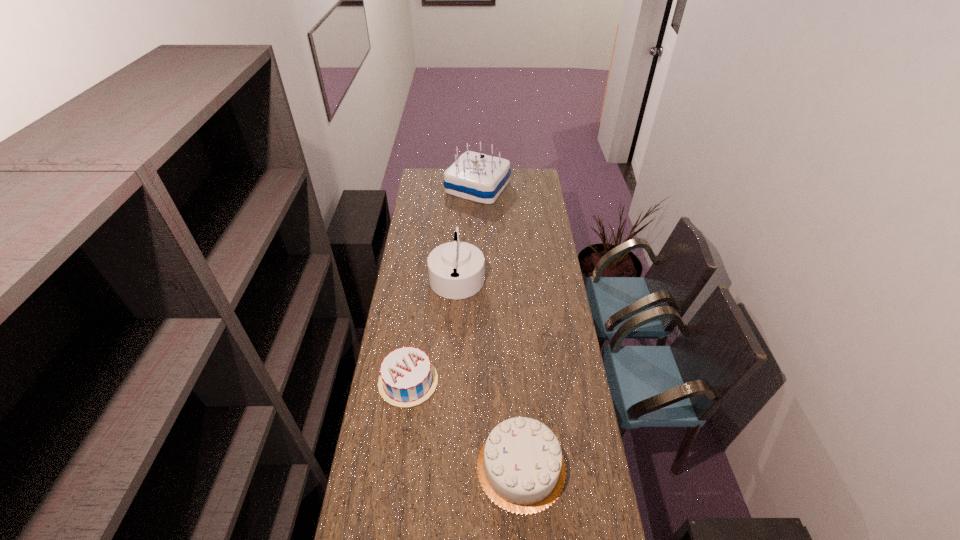
Find the location of a particular element. The width and height of the screenshot is (960, 540). vacant space situated on the back of the nearest birthday cake is located at coordinates (515, 369).

Where is `blank area located on the back of the second nearest object`? The height and width of the screenshot is (540, 960). blank area located on the back of the second nearest object is located at coordinates (414, 344).

The width and height of the screenshot is (960, 540). Identify the location of object present at the far edge. (474, 176).

Where is `kettle located in the left edge section of the desktop`? kettle located in the left edge section of the desktop is located at coordinates (456, 269).

Image resolution: width=960 pixels, height=540 pixels. What are the coordinates of `birthday cake at the left edge` in the screenshot? It's located at (407, 378).

Where is `object located in the right edge section of the desktop`? The height and width of the screenshot is (540, 960). object located in the right edge section of the desktop is located at coordinates (521, 468).

At what (x,y) coordinates should I click in order to perform the action: click on free space at the left edge of the desktop. Please return your answer as a coordinate pair (x, y). Looking at the image, I should click on (438, 194).

At what (x,y) coordinates should I click in order to perform the action: click on blank space at the right edge of the desktop. Please return your answer as a coordinate pair (x, y). Looking at the image, I should click on coord(553,258).

In the image, there is a desktop. Identify the location of vacant space at the far right corner. (524, 187).

This screenshot has height=540, width=960. I want to click on empty location between the farthest birthday cake and the nearest birthday cake, so click(499, 327).